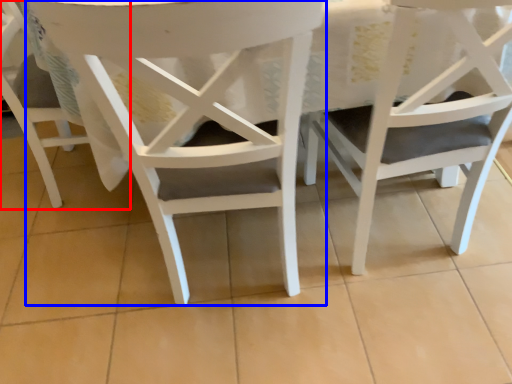
Question: Which of the following is the farthest to the observer, chair (highlighted by a red box) or chair (highlighted by a blue box)?

Choices:
 (A) chair
 (B) chair

Answer: (A)